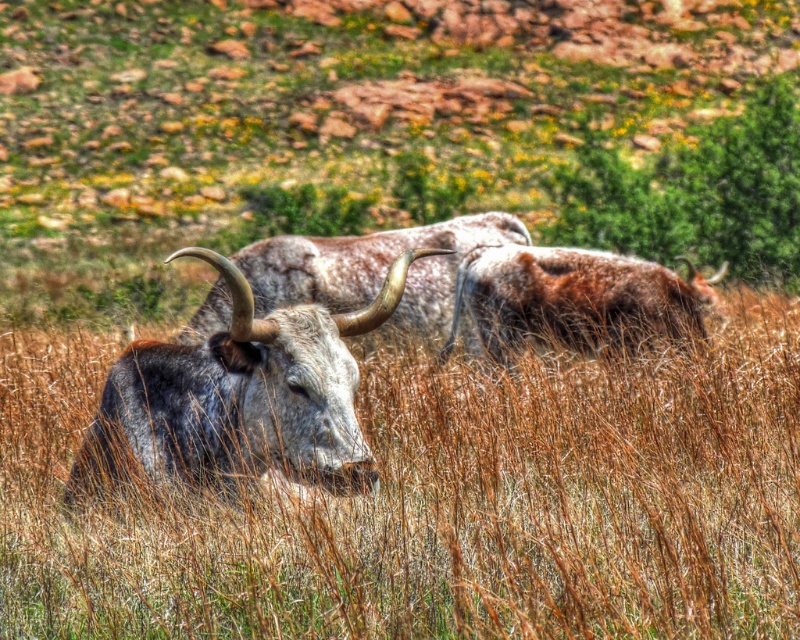
Which of these two, brown fuzzy yak at center or speckled fur yak at center, stands shorter?

brown fuzzy yak at center is shorter.

Does brown fuzzy yak at center have a lesser height compared to speckled fur yak at center?

Correct, brown fuzzy yak at center is not as tall as speckled fur yak at center.

Between point (472, 291) and point (264, 252), which one is positioned behind?

The point (264, 252) is more distant.

What are the coordinates of `brown fuzzy yak at center` in the screenshot? It's located at (576, 296).

Can you confirm if speckled gray cow at center is positioned below brown fuzzy yak at center?

Indeed, speckled gray cow at center is positioned under brown fuzzy yak at center.

Consider the image. Can you confirm if speckled gray cow at center is shorter than brown fuzzy yak at center?

No.

Locate an element on the screen. speckled gray cow at center is located at coordinates (240, 396).

Can you confirm if brown grass at center is shorter than speckled fur yak at center?

Yes, brown grass at center is shorter than speckled fur yak at center.

Does point (501, 621) come closer to viewer compared to point (310, 300)?

That is True.

The image size is (800, 640). What are the coordinates of `brown grass at center` in the screenshot? It's located at (440, 502).